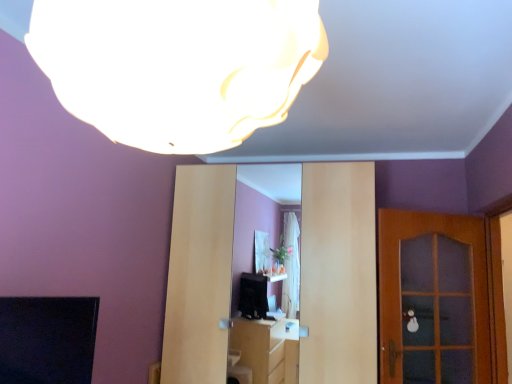
Question: Does white matte lampshade at upper center lie behind matte wood entertainment center at center?

Choices:
 (A) no
 (B) yes

Answer: (A)

Question: Considering the relative sizes of white matte lampshade at upper center and matte wood entertainment center at center in the image provided, is white matte lampshade at upper center bigger than matte wood entertainment center at center?

Choices:
 (A) no
 (B) yes

Answer: (A)

Question: Is white matte lampshade at upper center positioned with its back to matte wood entertainment center at center?

Choices:
 (A) no
 (B) yes

Answer: (A)

Question: Is white matte lampshade at upper center taller than matte wood entertainment center at center?

Choices:
 (A) no
 (B) yes

Answer: (A)

Question: From the image's perspective, is white matte lampshade at upper center located beneath matte wood entertainment center at center?

Choices:
 (A) yes
 (B) no

Answer: (B)

Question: Considering the relative sizes of white matte lampshade at upper center and matte wood entertainment center at center in the image provided, is white matte lampshade at upper center wider than matte wood entertainment center at center?

Choices:
 (A) yes
 (B) no

Answer: (B)

Question: Is wooden door at right at the right side of matte wood entertainment center at center?

Choices:
 (A) yes
 (B) no

Answer: (A)

Question: Does wooden door at right touch matte wood entertainment center at center?

Choices:
 (A) yes
 (B) no

Answer: (B)

Question: Is wooden door at right at the left side of matte wood entertainment center at center?

Choices:
 (A) yes
 (B) no

Answer: (B)

Question: Considering the relative positions of wooden door at right and matte wood entertainment center at center in the image provided, is wooden door at right behind matte wood entertainment center at center?

Choices:
 (A) no
 (B) yes

Answer: (B)

Question: Is wooden door at right positioned far away from matte wood entertainment center at center?

Choices:
 (A) yes
 (B) no

Answer: (A)

Question: Is wooden door at right facing towards matte wood entertainment center at center?

Choices:
 (A) no
 (B) yes

Answer: (A)

Question: Is matte wood entertainment center at center touching white matte lampshade at upper center?

Choices:
 (A) yes
 (B) no

Answer: (B)